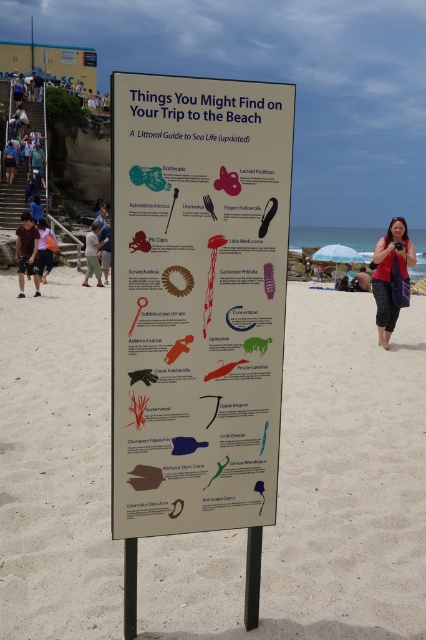
You are a photographer trying to capture both the brown cotton shorts at lower left and the matte pink shirt at center in a single frame. Which clothing item appears smaller in the photo?

The brown cotton shorts at lower left appears smaller in the photo because it has a smaller size compared to the matte pink shirt at center.